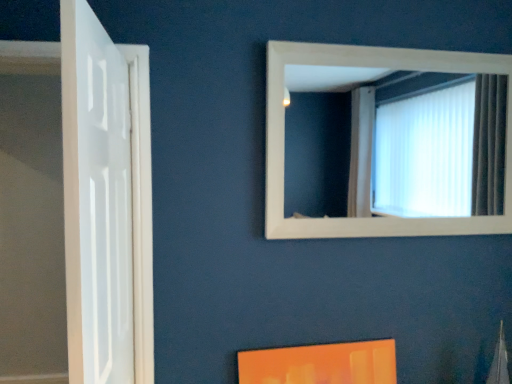
At what (x,y) coordinates should I click in order to perform the action: click on white glossy door at left. Please return your answer as a coordinate pair (x, y). Looking at the image, I should click on (105, 202).

What is the approximate width of white glossy door at left?

5.53 inches.

What do you see at coordinates (105, 202) in the screenshot? The image size is (512, 384). I see `white glossy door at left` at bounding box center [105, 202].

Image resolution: width=512 pixels, height=384 pixels. Describe the element at coordinates (380, 67) in the screenshot. I see `white wooden frame at upper center` at that location.

I want to click on white wooden frame at upper center, so click(x=380, y=67).

Locate an element on the screen. white glossy door at left is located at coordinates (105, 202).

Can you confirm if white glossy door at left is positioned to the right of white wooden frame at upper center?

In fact, white glossy door at left is to the left of white wooden frame at upper center.

In the image, is white glossy door at left positioned in front of or behind white wooden frame at upper center?

Clearly, white glossy door at left is in front of white wooden frame at upper center.

Which is closer, (127, 248) or (428, 221)?

The point (127, 248) is in front.

From the image's perspective, is white glossy door at left below white wooden frame at upper center?

Correct, white glossy door at left appears lower than white wooden frame at upper center in the image.

From a real-world perspective, who is located higher, white glossy door at left or white wooden frame at upper center?

In real-world perspective, white wooden frame at upper center is above.

Consider the image. Which object is thinner, white glossy door at left or white wooden frame at upper center?

white wooden frame at upper center is thinner.

In the scene shown: Considering the relative sizes of white glossy door at left and white wooden frame at upper center in the image provided, is white glossy door at left shorter than white wooden frame at upper center?

In fact, white glossy door at left may be taller than white wooden frame at upper center.

Does white glossy door at left have a larger size compared to white wooden frame at upper center?

Yes, white glossy door at left is bigger than white wooden frame at upper center.

Is white wooden frame at upper center surrounded by white glossy door at left?

That's incorrect, white wooden frame at upper center is not inside white glossy door at left.

Would you consider white glossy door at left to be distant from white wooden frame at upper center?

No, white glossy door at left is not far from white wooden frame at upper center.

Is white glossy door at left turned away from white wooden frame at upper center?

That's right, white glossy door at left is facing away from white wooden frame at upper center.

Where is `door on the left of white wooden frame at upper center`? Image resolution: width=512 pixels, height=384 pixels. door on the left of white wooden frame at upper center is located at coordinates (105, 202).

Visually, is white wooden frame at upper center positioned to the left or to the right of white glossy door at left?

In the image, white wooden frame at upper center appears on the right side of white glossy door at left.

Between white wooden frame at upper center and white glossy door at left, which one is positioned behind?

white wooden frame at upper center is more distant.

Between point (507, 156) and point (147, 277), which one is positioned behind?

The point (507, 156) is farther.

From the image's perspective, is white wooden frame at upper center above or below white glossy door at left?

white wooden frame at upper center is above white glossy door at left.

From a real-world perspective, relative to white glossy door at left, is white wooden frame at upper center vertically above or below?

From a real-world perspective, white wooden frame at upper center is physically above white glossy door at left.

Considering the relative sizes of white wooden frame at upper center and white glossy door at left in the image provided, is white wooden frame at upper center wider than white glossy door at left?

Incorrect, the width of white wooden frame at upper center does not surpass that of white glossy door at left.

Considering the sizes of objects white wooden frame at upper center and white glossy door at left in the image provided, who is taller, white wooden frame at upper center or white glossy door at left?

white glossy door at left.

Does white wooden frame at upper center have a larger size compared to white glossy door at left?

Incorrect, white wooden frame at upper center is not larger than white glossy door at left.

Is white wooden frame at upper center not inside white glossy door at left?

That's correct, white wooden frame at upper center is outside of white glossy door at left.

Are white wooden frame at upper center and white glossy door at left beside each other?

No, white wooden frame at upper center is not with white glossy door at left.

Looking at this image, is white wooden frame at upper center oriented towards white glossy door at left?

No.

Image resolution: width=512 pixels, height=384 pixels. What are the coordinates of `door below the white wooden frame at upper center (from a real-world perspective)` in the screenshot? It's located at (105, 202).

Identify the location of door that appears in front of the white wooden frame at upper center. (105, 202).

Find the location of `window behind the white glossy door at left`. window behind the white glossy door at left is located at coordinates (380, 67).